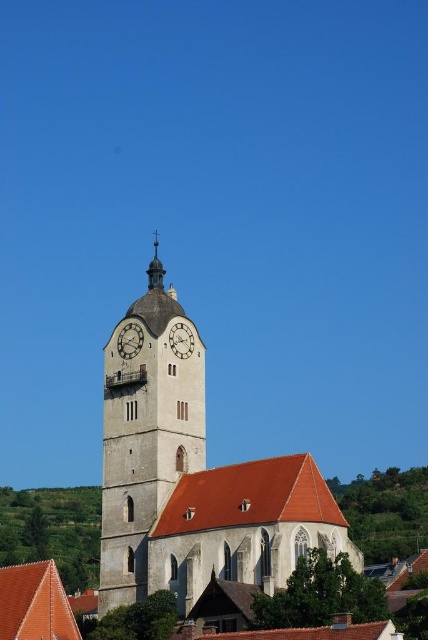
Question: Which is farther from the white stone clock tower at center?

Choices:
 (A) matte stone church at center
 (B) metallic clock face at center
 (C) matte gray clock at upper center

Answer: (B)

Question: Among these points, which one is farthest from the camera?

Choices:
 (A) (180, 356)
 (B) (127, 349)

Answer: (B)

Question: Among these objects, which one is nearest to the camera?

Choices:
 (A) gold textured cross at upper center
 (B) matte gray clock at upper center
 (C) metallic clock face at center
 (D) white stone clock tower at center

Answer: (D)

Question: Can you confirm if matte gray clock at upper center is positioned below metallic clock face at center?

Choices:
 (A) yes
 (B) no

Answer: (B)

Question: Can you confirm if matte stone church at center is positioned to the right of gold textured cross at upper center?

Choices:
 (A) yes
 (B) no

Answer: (B)

Question: From the image, what is the correct spatial relationship of matte stone church at center in relation to white stone clock tower at center?

Choices:
 (A) left
 (B) right

Answer: (A)